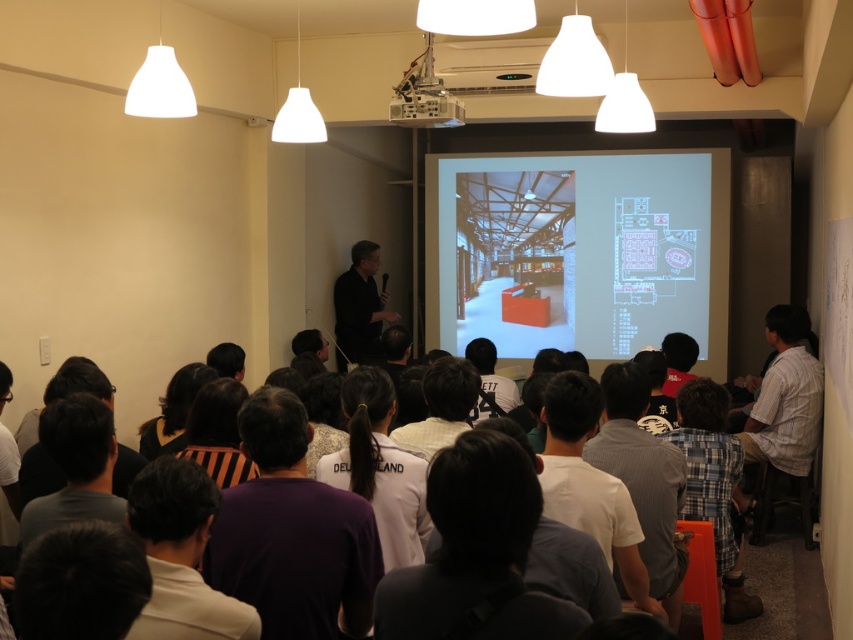
Question: Considering the real-world distances, which object is farthest from the black hair at center?

Choices:
 (A) striped fabric shirt at center
 (B) gray cotton shirt at center
 (C) matte white projector screen at center
 (D) dark brown hair at center

Answer: (C)

Question: Observing the image, what is the correct spatial positioning of dark brown hair at center in reference to dark gray hair at lower left?

Choices:
 (A) left
 (B) right

Answer: (B)

Question: Which is farther from the dark gray shirt at center?

Choices:
 (A) gray cotton shirt at center
 (B) white plastic projector at upper center
 (C) black matte shirt at center

Answer: (A)

Question: Can you confirm if matte white projector screen at center is positioned above gray cotton shirt at center?

Choices:
 (A) yes
 (B) no

Answer: (A)

Question: Which object appears farthest from the camera in this image?

Choices:
 (A) white jersey at center
 (B) black matte shirt at center
 (C) striped fabric shirt at center

Answer: (B)

Question: Is plaid fabric shirt at lower right further to camera compared to dark gray shirt at center?

Choices:
 (A) no
 (B) yes

Answer: (A)